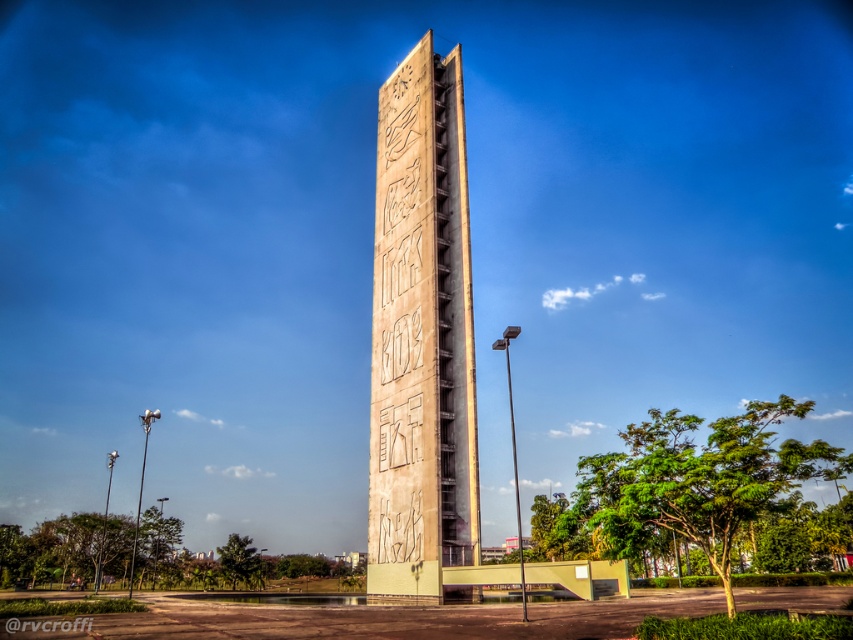
You are standing at the entrance of the monument area and want to reach the beige concrete tower at center. According to the coordinates provided, is the tower located closer to the northern or southern part of the area?

The beige concrete tower at center is located at coordinates point [421,336], which places it near the center of the area. Since the coordinates are nearly equal in both axes, it is approximately centered between north and south, so it is neither closer to the northern nor southern part but at the center.

You are standing at the base of the beige concrete tower at center and want to walk to the top. The monument has a staircase on one side. Given that the staircase is 45 meters long, will you reach the top before the staircase ends?

The distance between you and the beige concrete tower at center is 50.04 meters, but the staircase is only 45 meters long. Therefore, the staircase will end before you reach the top of the beige concrete tower at center.

You are planning to take a photo of the beige concrete tower at center and the carved stone monument at center from the paved pathway. Which object will appear bigger in your photo?

The beige concrete tower at center will appear bigger in the photo since it has a larger size compared to the carved stone monument at center.